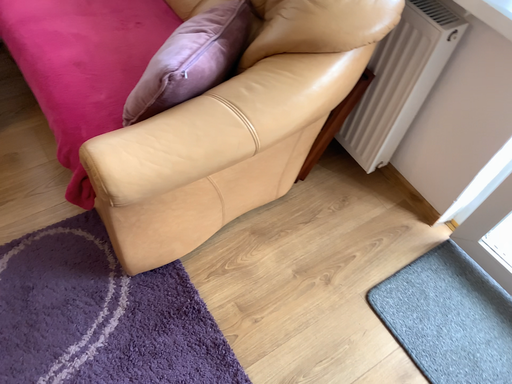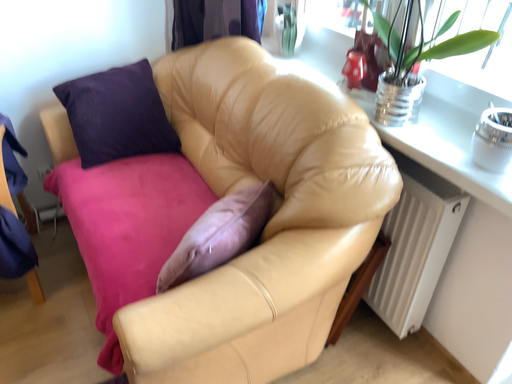
Question: How did the camera likely rotate when shooting the video?

Choices:
 (A) rotated downward
 (B) rotated upward

Answer: (B)